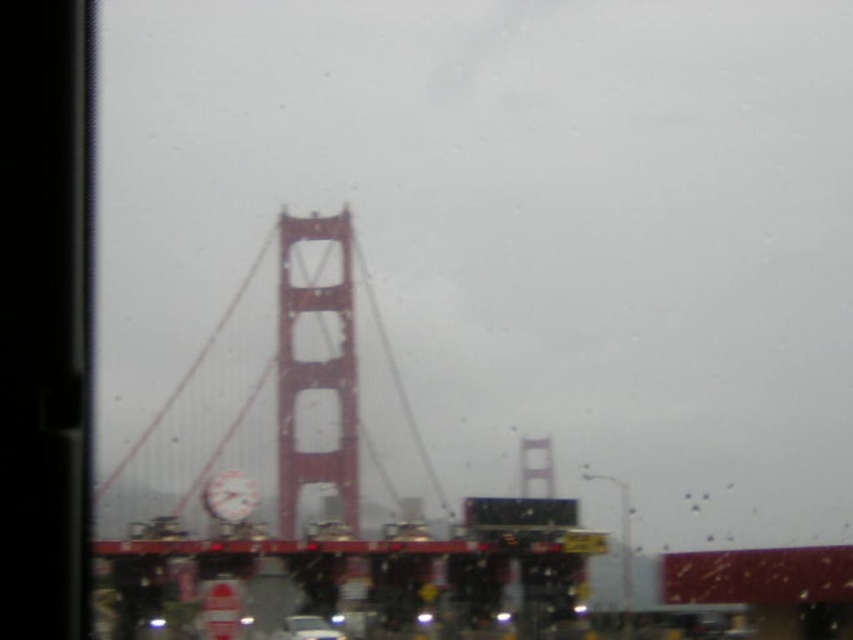
Question: Which of the following is the closest to the observer?

Choices:
 (A) (289, 618)
 (B) (366, 452)

Answer: (A)

Question: Which point is closer to the camera taking this photo?

Choices:
 (A) (223, 566)
 (B) (323, 627)

Answer: (A)

Question: Does metallic red suspension bridge at center lie behind metallic silver car at center?

Choices:
 (A) yes
 (B) no

Answer: (B)

Question: Which object is farther from the camera taking this photo?

Choices:
 (A) metallic silver car at center
 (B) metallic red suspension bridge at center

Answer: (A)

Question: Does metallic red suspension bridge at center lie in front of metallic silver car at center?

Choices:
 (A) no
 (B) yes

Answer: (B)

Question: Is metallic red suspension bridge at center thinner than metallic silver car at center?

Choices:
 (A) no
 (B) yes

Answer: (A)